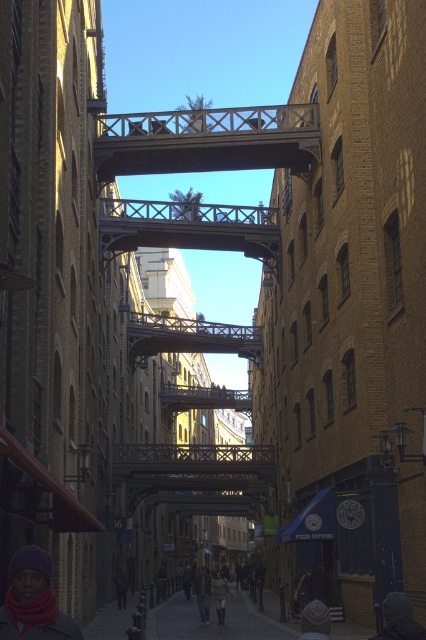
You are a delivery person standing on the metallic bridge at center, and you need to pick up a dark gray knit hat at lower right. Can you reach it while staying on the bridge?

The dark gray knit hat at lower right is behind the metallic bridge at center, so you cannot reach it while staying on the bridge.

You are a delivery person carrying a package that requires you to stay within 200 feet of the knitted woolen hat at lower left. You see the wooden bridge at center. Can you cross it while staying within the required distance?

The wooden bridge at center is 195.38 feet away from the knitted woolen hat at lower left. Since 195.38 feet is less than 200 feet, you can cross the wooden bridge at center while staying within the required distance.

You are standing at the entrance of the alley and want to cross to the other side. The wooden bridge at center is your only option. Where should you look to find it?

The wooden bridge at center is located at the 2D coordinates point (207, 140), so you should look towards that position to find it.